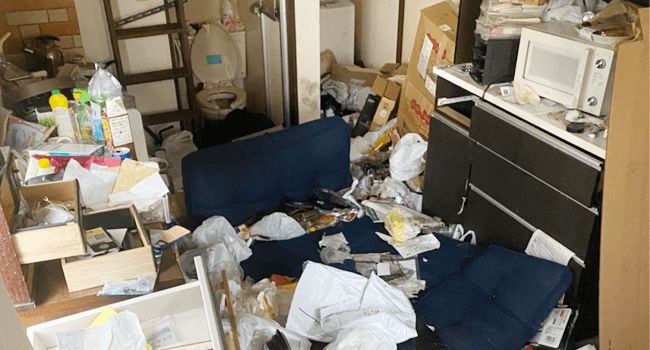
What are the coordinates of `microwave` in the screenshot? It's located at (567, 68).